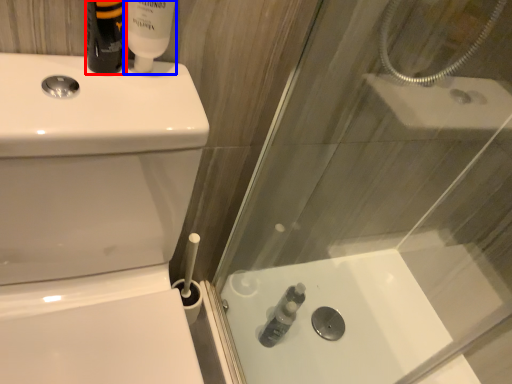
Question: Which point is closer to the camera, toiletry (highlighted by a red box) or toiletry (highlighted by a blue box)?

Choices:
 (A) toiletry
 (B) toiletry

Answer: (A)